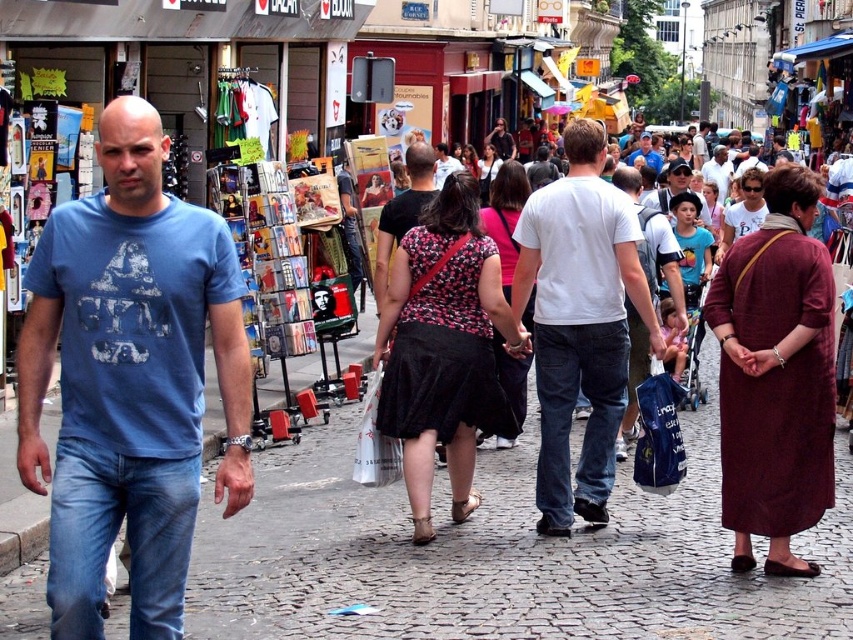
Question: Which point is farther to the camera?

Choices:
 (A) blue t-shirt at center
 (B) matte blue t-shirt at center
 (C) blue cotton t-shirt at left
 (D) white cotton t-shirt at center

Answer: (A)

Question: Among these points, which one is farthest from the camera?

Choices:
 (A) (563, 289)
 (B) (677, 172)
 (C) (595, 304)
 (D) (109, 496)

Answer: (B)

Question: Can you confirm if matte white shirt at center is smaller than blue t-shirt at center?

Choices:
 (A) no
 (B) yes

Answer: (B)

Question: Does matte white shirt at center appear under white cotton t-shirt at center?

Choices:
 (A) no
 (B) yes

Answer: (B)

Question: Is blue cotton t-shirt at left in front of white cotton shirt at center?

Choices:
 (A) yes
 (B) no

Answer: (A)

Question: Which point is closer to the camera taking this photo?

Choices:
 (A) (663, 192)
 (B) (717, 157)
 (C) (779, 262)
 (D) (639, 138)

Answer: (C)